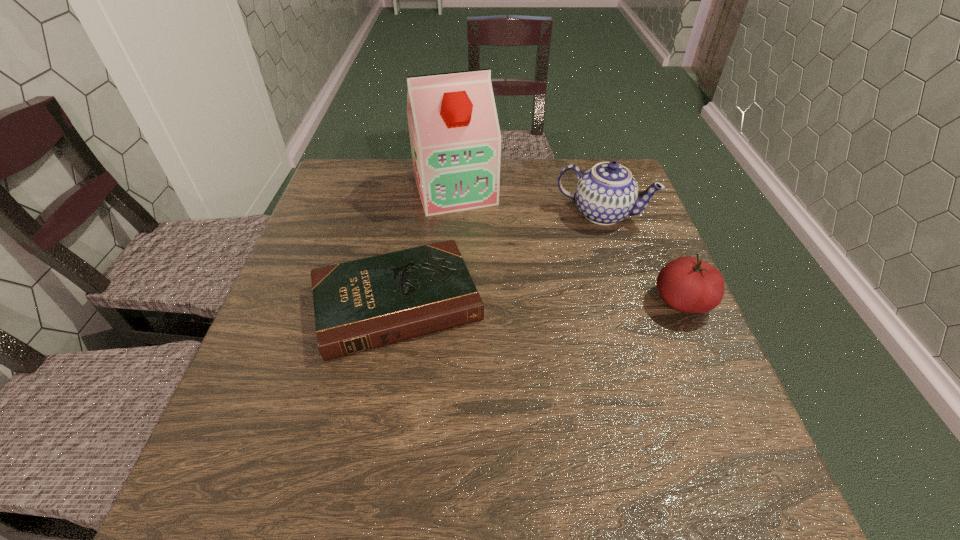
Where is `free space located 0.370m with the cap open on the soya milk`? free space located 0.370m with the cap open on the soya milk is located at coordinates (506, 319).

The width and height of the screenshot is (960, 540). Find the location of `free location located with the cap open on the soya milk`. free location located with the cap open on the soya milk is located at coordinates (473, 236).

The image size is (960, 540). In order to click on chinaware present at the far edge in this screenshot , I will do `click(607, 193)`.

Identify the location of soya milk that is at the far edge. The height and width of the screenshot is (540, 960). click(455, 137).

Where is `object that is positioned at the left edge`? The height and width of the screenshot is (540, 960). object that is positioned at the left edge is located at coordinates (359, 305).

Where is `tomato that is at the right edge`? tomato that is at the right edge is located at coordinates (687, 284).

Locate an element on the screen. chinaware that is positioned at the right edge is located at coordinates click(607, 193).

Find the location of a particular element. Image resolution: width=960 pixels, height=540 pixels. object located at the far right corner is located at coordinates (607, 193).

You are a GUI agent. You are given a task and a screenshot of the screen. Output one action in this format:
    pyautogui.click(x=<x>, y=<y>)
    Task: Click on the free spot at the far edge of the desktop
    
    Given the screenshot: What is the action you would take?
    pyautogui.click(x=512, y=172)

Locate an element on the screen. Image resolution: width=960 pixels, height=540 pixels. blank area at the near edge is located at coordinates (435, 409).